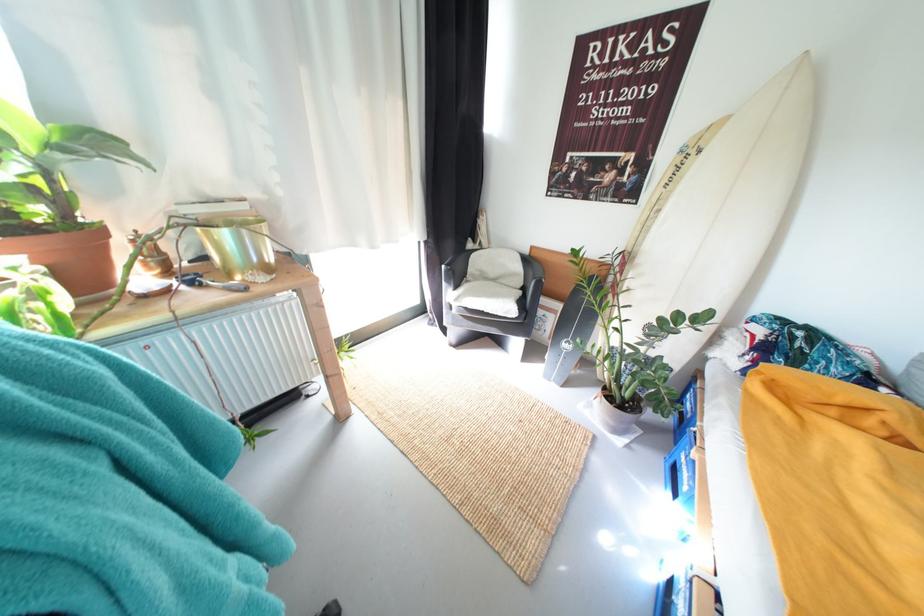
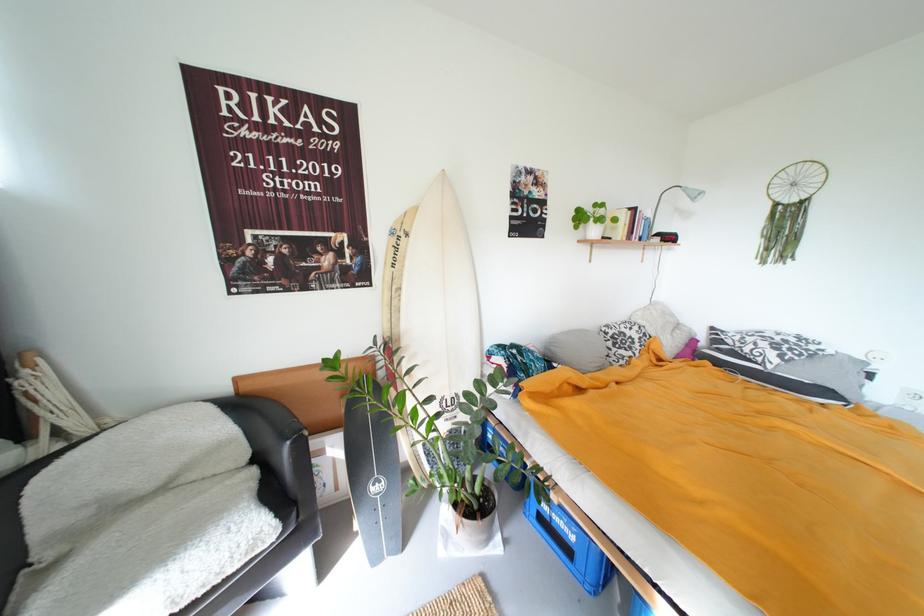
Where in the second image is the point corresponding to [538,257] from the first image?

(246, 395)